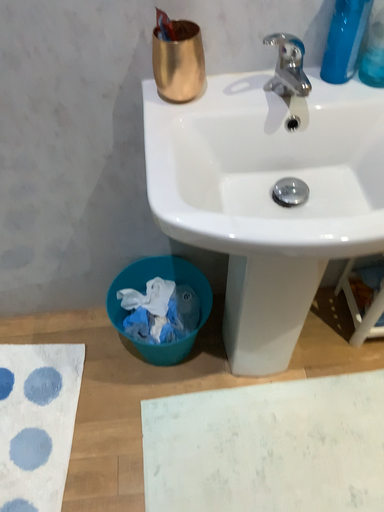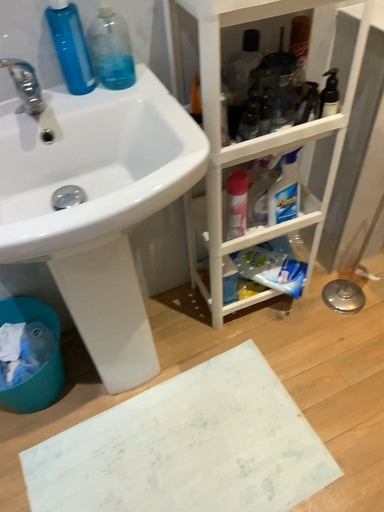
Question: How did the camera likely rotate when shooting the video?

Choices:
 (A) rotated upward
 (B) rotated downward

Answer: (A)